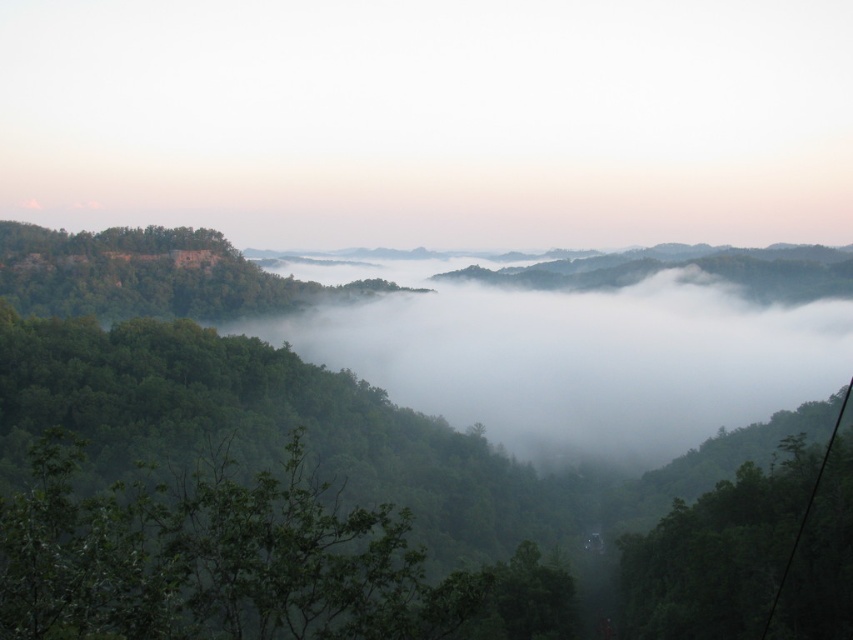
You are a photographer planning to capture the entire scene in one shot. Given that the green leafy tree at center and the black wire at lower right are both in your viewfinder, which object will appear smaller in the final photograph?

The green leafy tree at center will appear smaller in the final photograph because it occupies less space than the black wire at lower right according to the description.

You are a photographer standing in the forest and want to capture the green leafy tree at center without the black wire at lower right appearing in the frame. What adjustment can you make to your camera position?

Move your camera position to the left or right so that the green leafy tree at center is no longer aligned with the black wire at lower right, since the green leafy tree at center is positioned over the black wire at lower right.